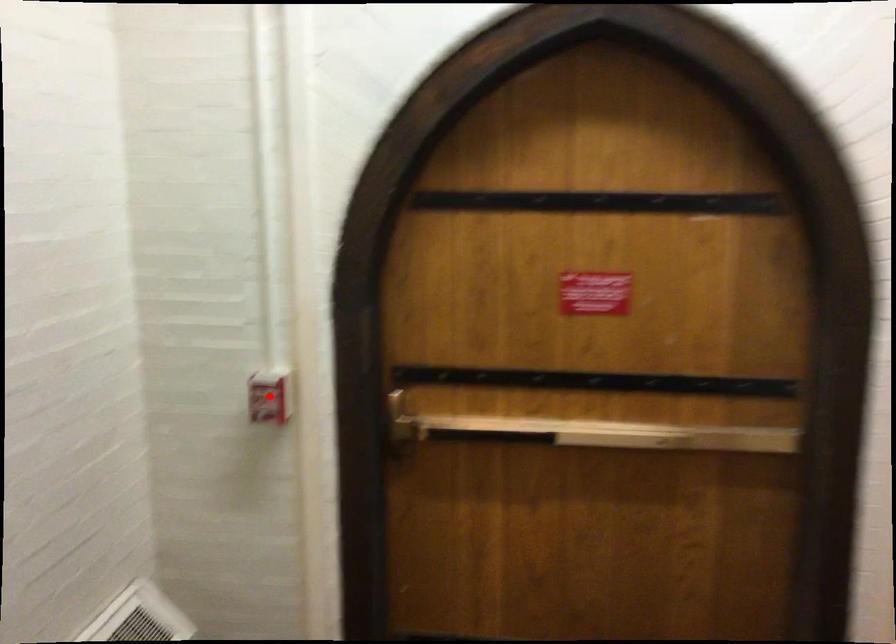
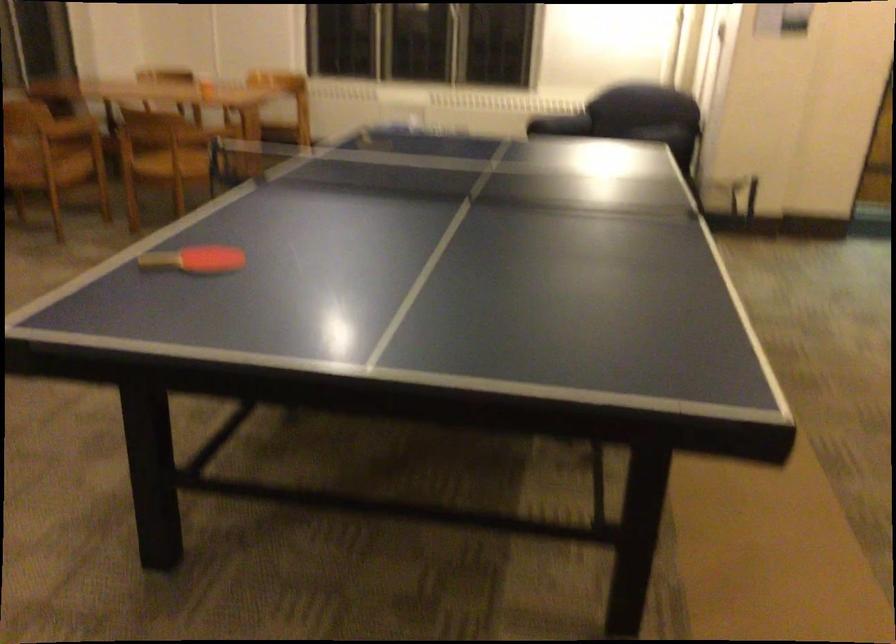
Question: I am providing you with two images of the same scene from different viewpoints. A red point is marked on the first image. Can you still see the location of the red point in image 2?

Choices:
 (A) Yes
 (B) No

Answer: (B)